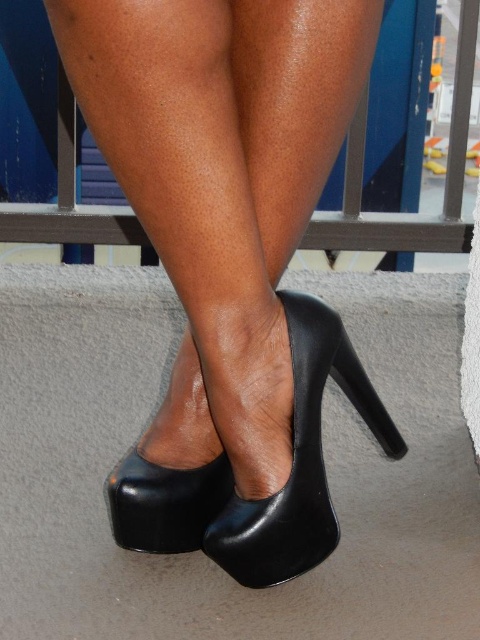
You are standing on the balcony and want to place a small potted plant between the two points marked as point (173, 3) and point (352, 122). Which point should the plant be closer to in order to be positioned in front of the second point?

The plant should be closer to point (173, 3) because it is in front of point (352, 122), so placing it near the first point ensures it is in front of the second point.